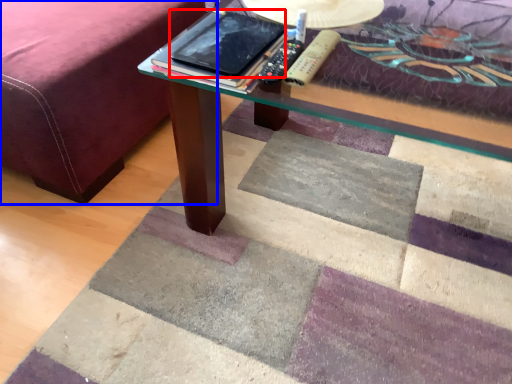
Question: Among these objects, which one is farthest to the camera, tablet computer (highlighted by a red box) or bed frame (highlighted by a blue box)?

Choices:
 (A) tablet computer
 (B) bed frame

Answer: (B)